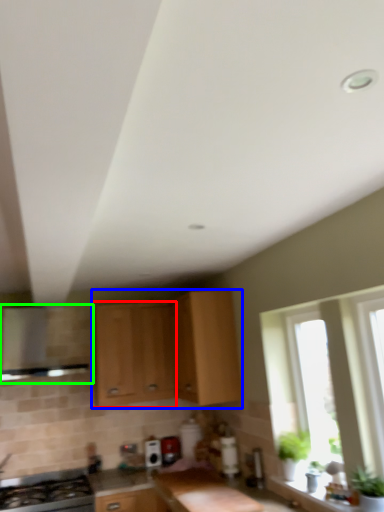
Question: Based on their relative distances, which object is nearer to cabinetry (highlighted by a red box)? Choose from cabinetry (highlighted by a blue box) and vent (highlighted by a green box).

Choices:
 (A) cabinetry
 (B) vent

Answer: (A)